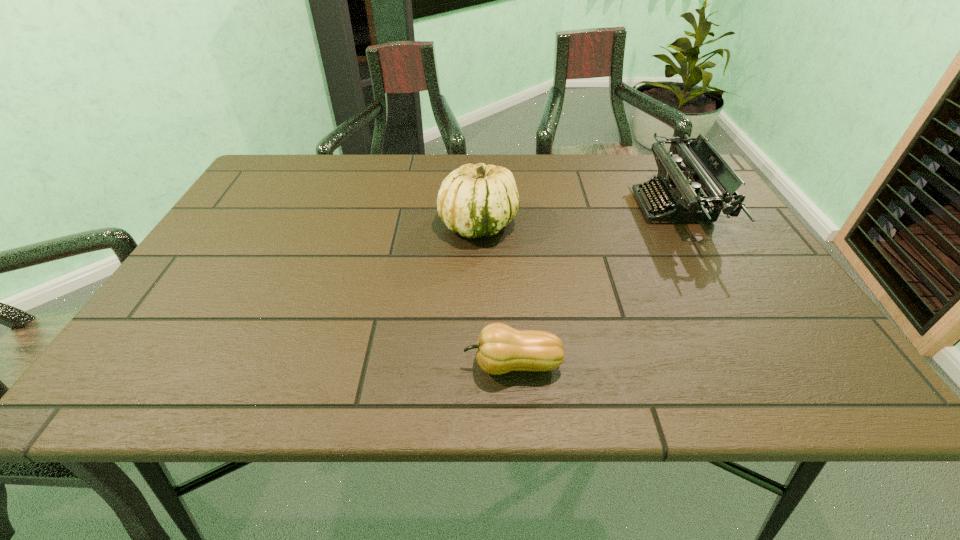
Locate which object ranks in proximity to the shorter gourd. Please provide its 2D coordinates. Your answer should be formatted as a tuple, i.e. [(x, y)], where the tuple contains the x and y coordinates of a point satisfying the conditions above.

[(478, 200)]

Find the location of a particular element. This screenshot has width=960, height=540. vacant area in the image that satisfies the following two spatial constraints: 1. on the typing side of the typewriter; 2. on the front side of the taller gourd is located at coordinates (682, 224).

This screenshot has height=540, width=960. In order to click on vacant space that satisfies the following two spatial constraints: 1. on the typing side of the typewriter; 2. on the front side of the taller gourd in this screenshot , I will do `click(682, 224)`.